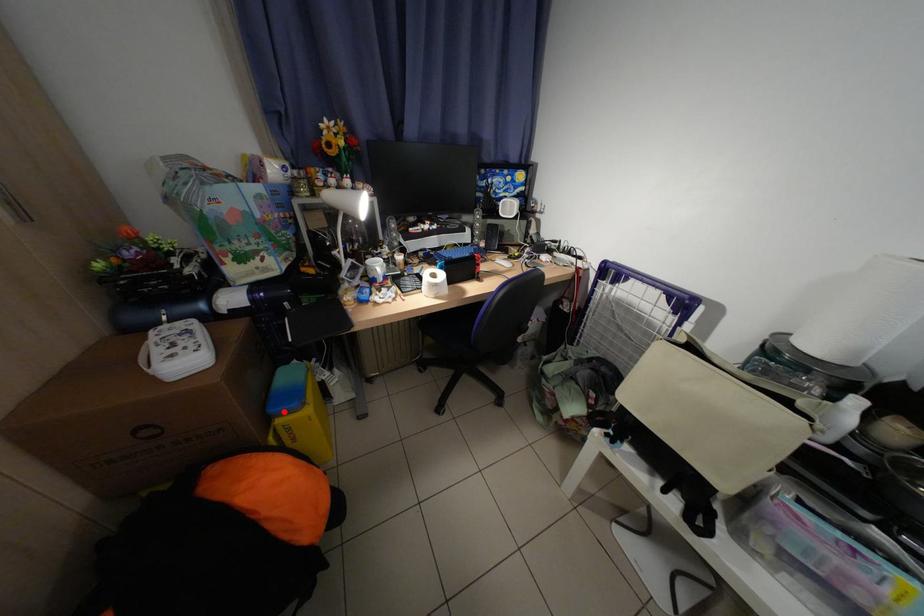
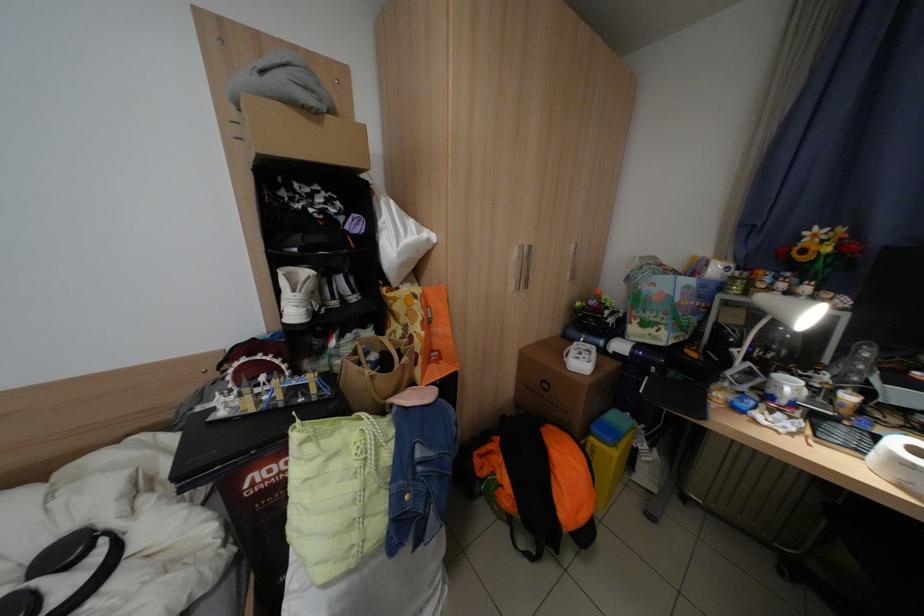
Locate, in the second image, the point that corresponds to the highlighted location in the first image.

(604, 430)